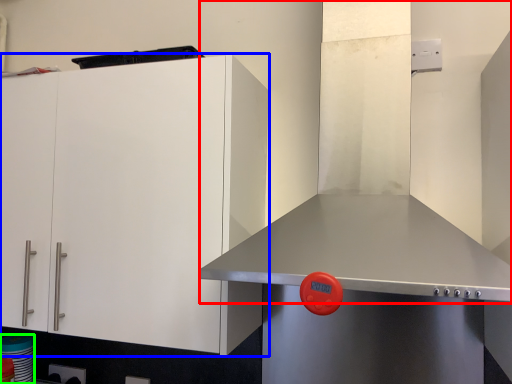
Question: Based on their relative distances, which object is nearer to exhaust hood (highlighted by a red box)? Choose from cabinetry (highlighted by a blue box) and appliance (highlighted by a green box).

Choices:
 (A) cabinetry
 (B) appliance

Answer: (A)